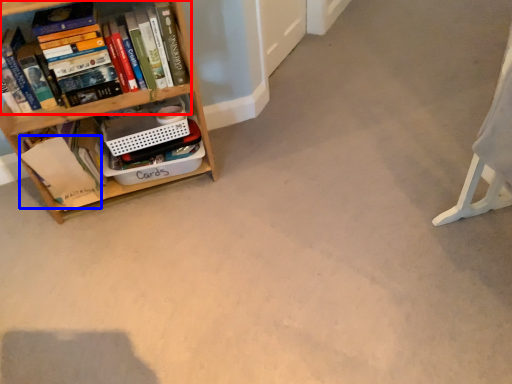
Question: Which object appears closest to the camera in this image, book (highlighted by a red box) or paperback book (highlighted by a blue box)?

Choices:
 (A) book
 (B) paperback book

Answer: (A)